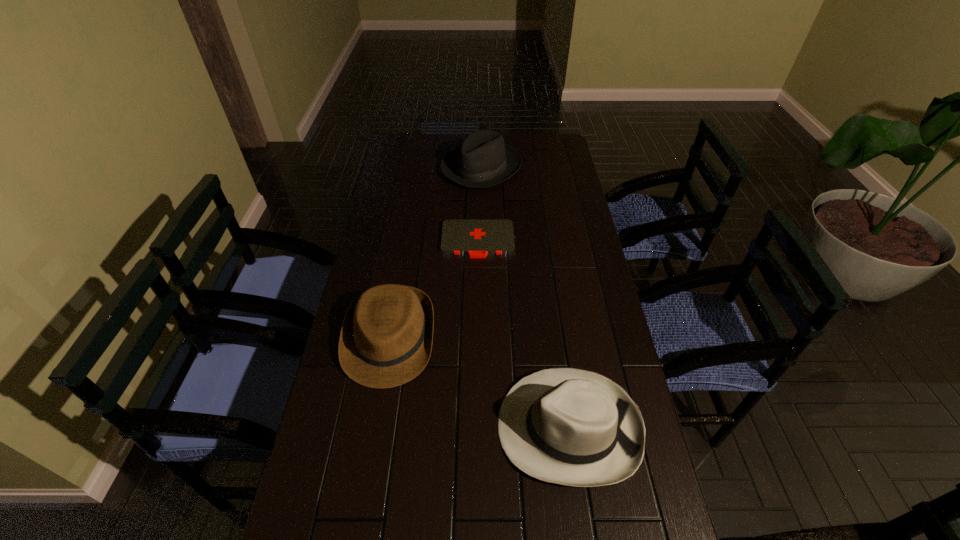
You are a GUI agent. You are given a task and a screenshot of the screen. Output one action in this format:
    pyautogui.click(x=<x>, y=<y>)
    Task: Click on the free space at the far edge of the desktop
    This screenshot has height=540, width=960.
    Given the screenshot: What is the action you would take?
    pyautogui.click(x=447, y=136)

The width and height of the screenshot is (960, 540). In the image, there is a desktop. What are the coordinates of `vacant space at the left edge` in the screenshot? It's located at (342, 398).

Locate an element on the screen. This screenshot has width=960, height=540. free space at the right edge of the desktop is located at coordinates (553, 163).

Locate an element on the screen. free space at the far left corner of the desktop is located at coordinates (416, 151).

Find the location of `vacant area that lies between the farthest object and the third tallest object`. vacant area that lies between the farthest object and the third tallest object is located at coordinates (436, 254).

Locate an element on the screen. unoccupied position between the farthest object and the third tallest object is located at coordinates (436, 254).

Locate an element on the screen. vacant space that's between the farthest object and the shortest object is located at coordinates (480, 204).

Locate an element on the screen. This screenshot has width=960, height=540. free space that is in between the second farthest object and the shortest fedora is located at coordinates (434, 289).

Select which object appears as the third closest to the farthest fedora. Please provide its 2D coordinates. Your answer should be formatted as a tuple, i.e. [(x, y)], where the tuple contains the x and y coordinates of a point satisfying the conditions above.

[(567, 426)]

Where is `the closest object relative to the shortest object`? The width and height of the screenshot is (960, 540). the closest object relative to the shortest object is located at coordinates (386, 338).